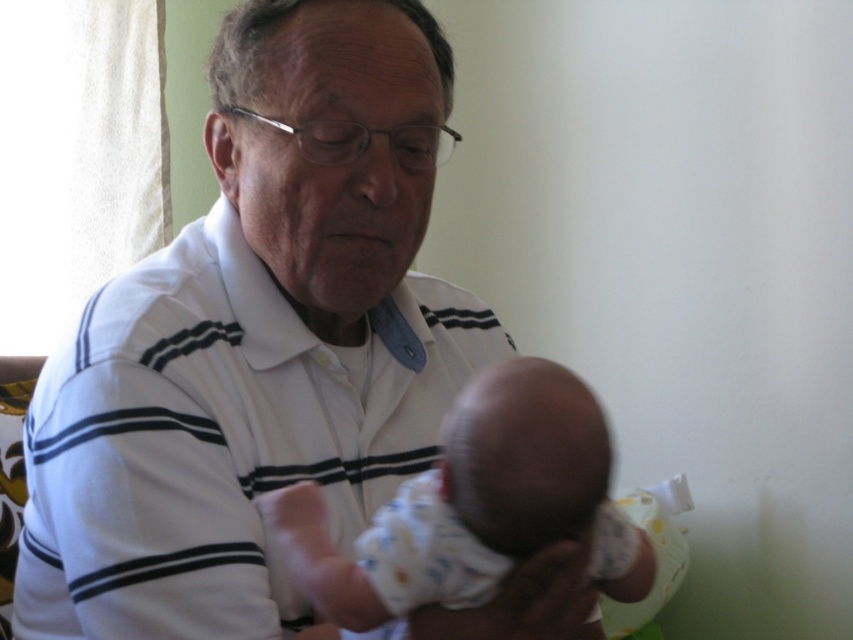
You are standing in the room and see two points marked in the image. Which point is closer to you, point (x=395, y=257) or point (x=283, y=496)?

Point (x=283, y=496) is closer to you than point (x=395, y=257) because the description states that point (x=395, y=257) is further to the camera than point (x=283, y=496).

You are a photographer setting up a photo shoot. You need to place a small prop between the white striped shirt at center and the white cotton baby at center. Considering their sizes, which object should the prop be placed closer to?

The white striped shirt at center is bigger than the white cotton baby at center, so the prop should be placed closer to the white cotton baby at center to maintain balance in the composition.

You are a photographer adjusting the lighting for a portrait. The subject is the older man holding the baby. You need to ensure the lighting highlights both the white striped shirt at center and the white cotton baby at center equally. Given the current setup, which object might require additional lighting to achieve even illumination?

The white cotton baby at center might require additional lighting because the white striped shirt at center is closer to the light source, making it naturally brighter. To balance the exposure, the baby needs more light to match the shirt.